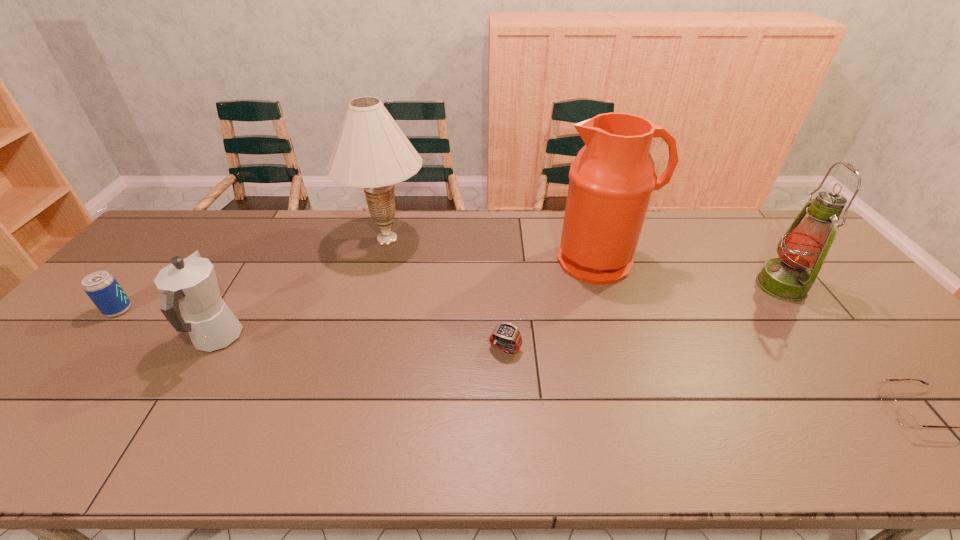
Locate an element on the screen. The width and height of the screenshot is (960, 540). vacant space at the near edge is located at coordinates (297, 446).

In the image, there is a desktop. Find the location of `vacant space at the left edge`. vacant space at the left edge is located at coordinates (115, 345).

At what (x,y) coordinates should I click in order to perform the action: click on free space at the right edge. Please return your answer as a coordinate pair (x, y). The width and height of the screenshot is (960, 540). Looking at the image, I should click on (817, 292).

Identify the location of vacant space at the far left corner of the desktop. (181, 232).

This screenshot has height=540, width=960. In order to click on free space between the fourth tallest object and the watch in this screenshot , I will do `click(361, 343)`.

Identify the location of vacant space that's between the oil lamp and the sixth object from right to left. The height and width of the screenshot is (540, 960). (499, 313).

Image resolution: width=960 pixels, height=540 pixels. In order to click on free space between the oil lamp and the fifth tallest object in this screenshot , I will do `click(450, 298)`.

Locate an element on the screen. This screenshot has height=540, width=960. free space between the leftmost object and the lampshade is located at coordinates (252, 274).

Where is `vacant space that is in between the lampshade and the watch`? The width and height of the screenshot is (960, 540). vacant space that is in between the lampshade and the watch is located at coordinates (446, 293).

The image size is (960, 540). I want to click on empty location between the watch and the water jug, so click(553, 304).